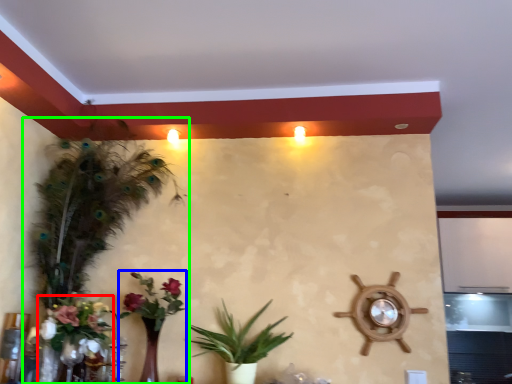
Question: Considering the real-world distances, which object is farthest from floral arrangement (highlighted by a red box)? floral arrangement (highlighted by a blue box) or houseplant (highlighted by a green box)?

Choices:
 (A) floral arrangement
 (B) houseplant

Answer: (A)